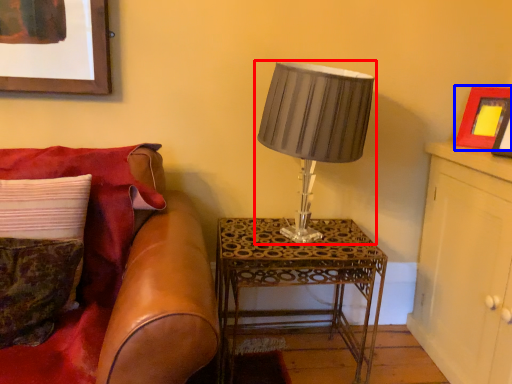
Question: Among these objects, which one is nearest to the camera, lamp (highlighted by a red box) or picture frame (highlighted by a blue box)?

Choices:
 (A) lamp
 (B) picture frame

Answer: (A)